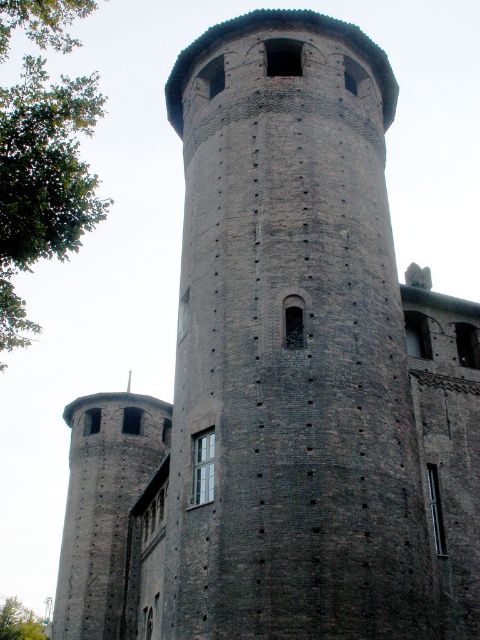
Question: Which point is closer to the camera?

Choices:
 (A) green leafy tree at left
 (B) green leafy tree at lower left

Answer: (A)

Question: Does green leafy tree at left lie behind green leafy tree at lower left?

Choices:
 (A) yes
 (B) no

Answer: (B)

Question: Which object appears farthest from the camera in this image?

Choices:
 (A) green leafy tree at lower left
 (B) green leafy tree at left

Answer: (A)

Question: Is green leafy tree at left below green leafy tree at lower left?

Choices:
 (A) yes
 (B) no

Answer: (B)

Question: Is green leafy tree at left further to the viewer compared to green leafy tree at lower left?

Choices:
 (A) yes
 (B) no

Answer: (B)